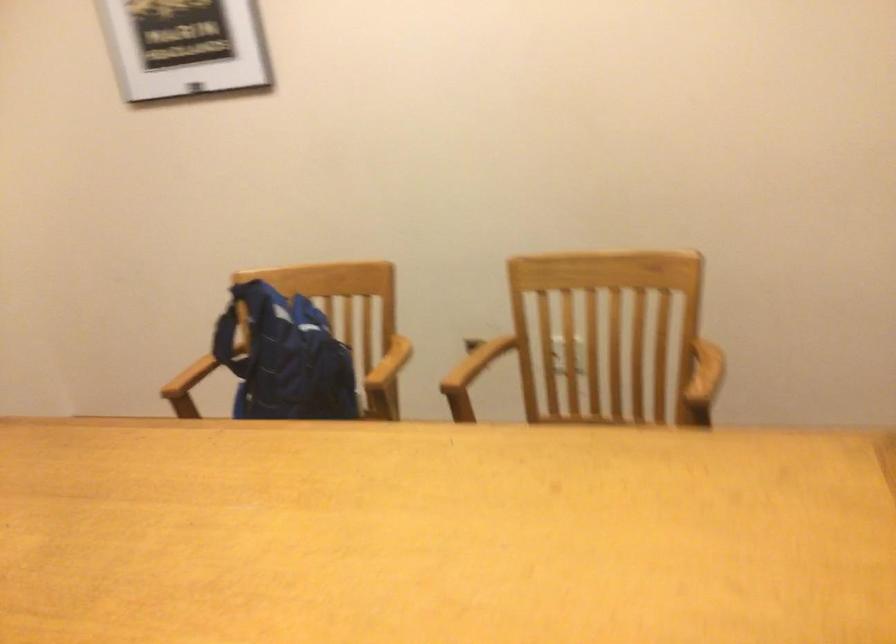
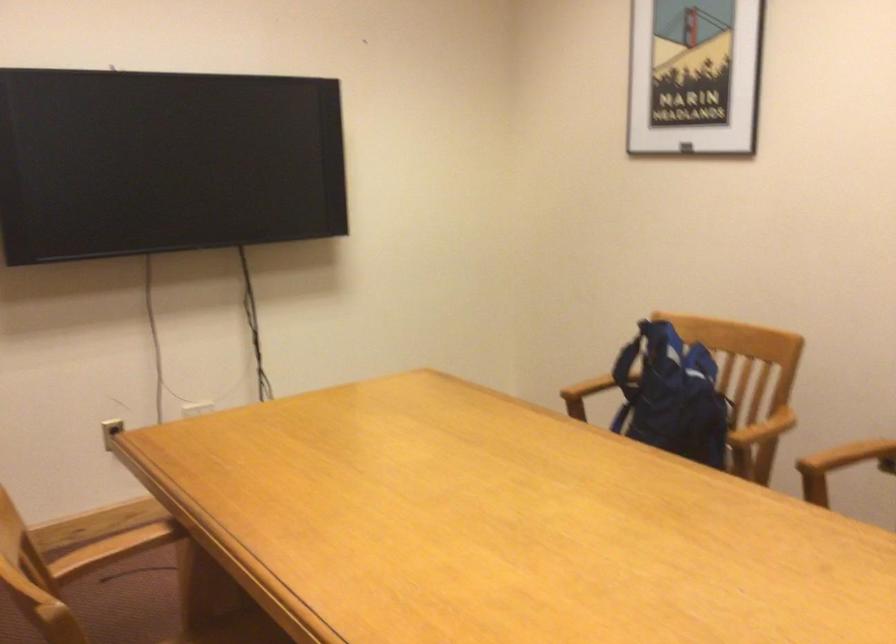
In the second image, find the point that corresponds to (487,353) in the first image.

(849, 456)